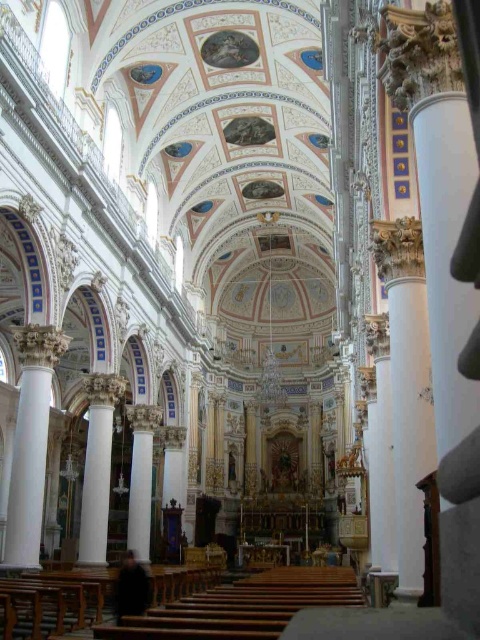
Question: Is white marble column at left closer to the viewer compared to white marble column at center?

Choices:
 (A) yes
 (B) no

Answer: (A)

Question: Which of the following is the farthest from the observer?

Choices:
 (A) (44, 369)
 (B) (136, 440)

Answer: (B)

Question: Is the position of white marble column at left more distant than that of white marble column at center?

Choices:
 (A) no
 (B) yes

Answer: (A)

Question: Among these objects, which one is nearest to the camera?

Choices:
 (A) white marble column at left
 (B) white marble column at center

Answer: (A)

Question: Which of the following is the closest to the observer?

Choices:
 (A) white marble column at center
 (B) white marble column at left

Answer: (B)

Question: Where is white marble column at left located in relation to white marble column at center in the image?

Choices:
 (A) above
 (B) below

Answer: (A)